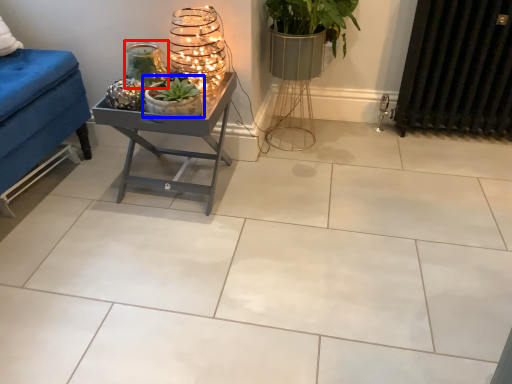
Question: Which of the following is the farthest to the observer, candle holder (highlighted by a red box) or houseplant (highlighted by a blue box)?

Choices:
 (A) candle holder
 (B) houseplant

Answer: (A)